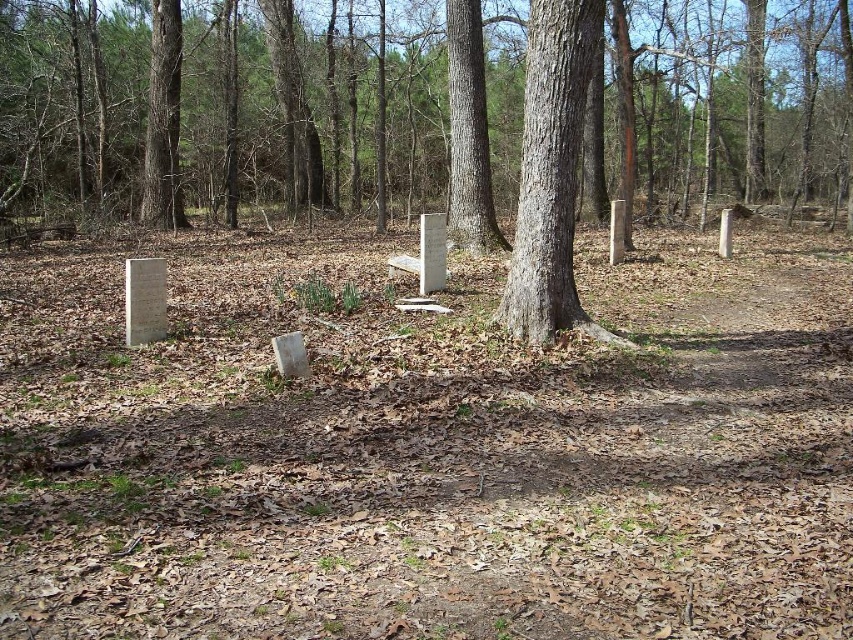
You are standing in the center of the cemetery and want to find the smooth gray tree trunk at center. According to the coordinates given, where should you look relative to your position?

The smooth gray tree trunk at center is located at point coordinates, so you should look towards the center of the scene where the coordinates indicate its position.